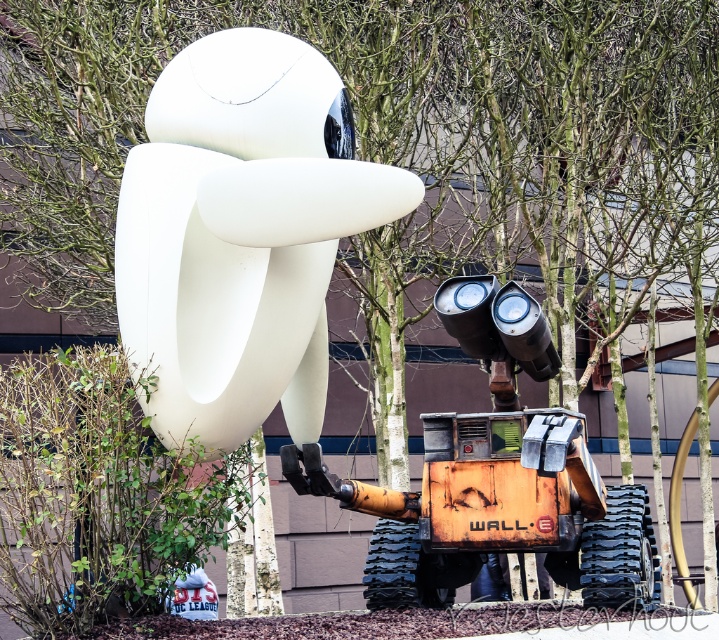
Locate an element on the screen. white matte sculpture at center is located at coordinates (242, 234).

Does white matte sculpture at center lie in front of orange metallic excavator at center?

Yes.

The image size is (719, 640). Find the location of `white matte sculpture at center`. white matte sculpture at center is located at coordinates (242, 234).